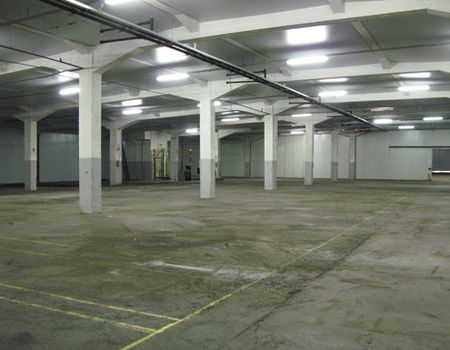
Where is `bar on door`? This screenshot has width=450, height=350. bar on door is located at coordinates (441, 170).